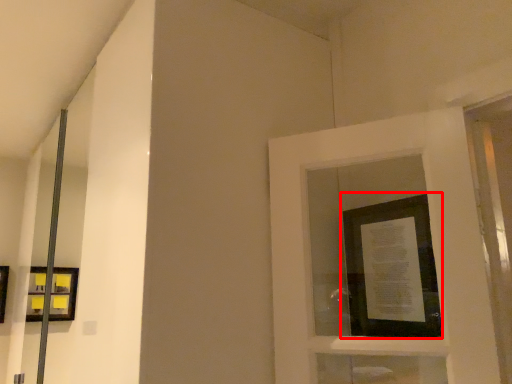
Question: From the image, what is the correct spatial relationship of picture frame (annotated by the red box) in relation to picture frame?

Choices:
 (A) right
 (B) left

Answer: (A)